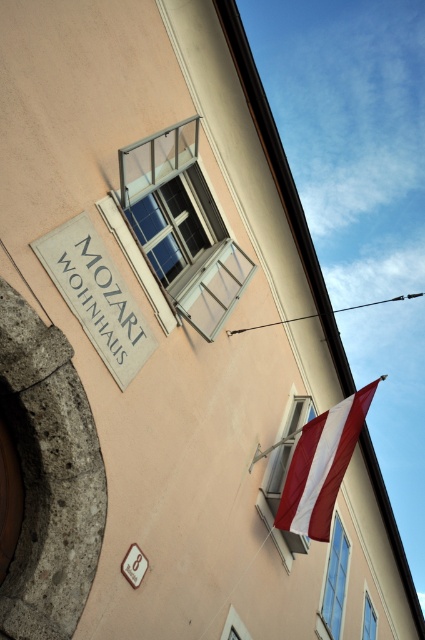
Based on the photo, which is above, red/white striped fabric at lower right or clear glass window at lower right?

red/white striped fabric at lower right is above.

Can you confirm if red/white striped fabric at lower right is positioned to the left of clear glass window at lower right?

Correct, you'll find red/white striped fabric at lower right to the left of clear glass window at lower right.

What do you see at coordinates (322, 465) in the screenshot? I see `red/white striped fabric at lower right` at bounding box center [322, 465].

The image size is (425, 640). In order to click on red/white striped fabric at lower right in this screenshot , I will do `click(322, 465)`.

Where is `clear glass window at lower right`? clear glass window at lower right is located at coordinates (336, 579).

The height and width of the screenshot is (640, 425). Find the location of `clear glass window at lower right`. clear glass window at lower right is located at coordinates (336, 579).

Which is more to the right, clear glass window at upper center or matte glass window at lower right?

matte glass window at lower right is more to the right.

Between clear glass window at upper center and matte glass window at lower right, which one has more height?

Standing taller between the two is clear glass window at upper center.

Between point (172, 216) and point (289, 413), which one is positioned in front?

Point (172, 216)

The width and height of the screenshot is (425, 640). Identify the location of clear glass window at upper center. (181, 227).